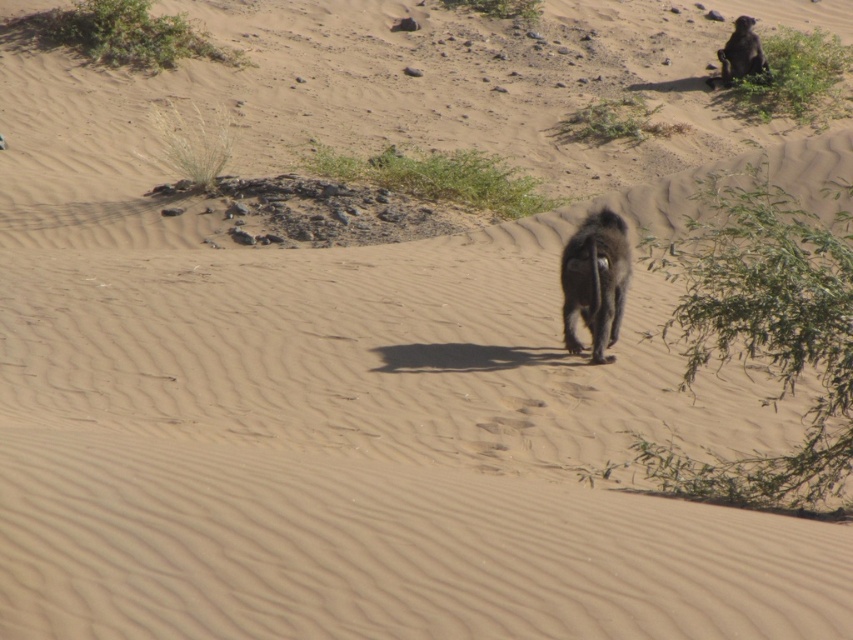
Question: Does brown furry monkey at center have a greater width compared to black furry monkey at upper right?

Choices:
 (A) no
 (B) yes

Answer: (A)

Question: In this image, where is brown furry monkey at center located relative to black furry monkey at upper right?

Choices:
 (A) right
 (B) left

Answer: (B)

Question: Does brown furry monkey at center have a greater width compared to black furry monkey at upper right?

Choices:
 (A) yes
 (B) no

Answer: (B)

Question: Which of the following is the farthest from the observer?

Choices:
 (A) (583, 301)
 (B) (730, 67)

Answer: (B)

Question: Which point is farther to the camera?

Choices:
 (A) black furry monkey at upper right
 (B) brown furry monkey at center

Answer: (A)